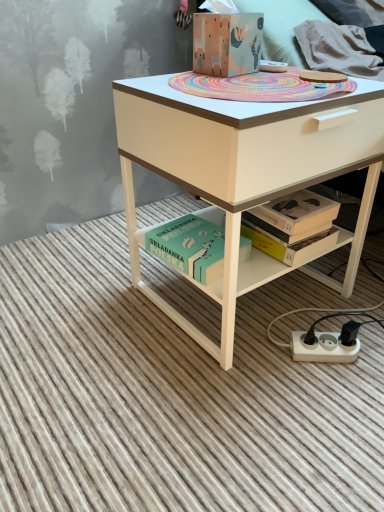
Question: From a real-world perspective, is white plastic power plugs and sockets at lower right on top of matte white desk at center?

Choices:
 (A) no
 (B) yes

Answer: (A)

Question: From the image's perspective, is white plastic power plugs and sockets at lower right under matte white desk at center?

Choices:
 (A) no
 (B) yes

Answer: (B)

Question: Considering the relative positions of white plastic power plugs and sockets at lower right and matte white desk at center in the image provided, is white plastic power plugs and sockets at lower right to the right of matte white desk at center from the viewer's perspective?

Choices:
 (A) yes
 (B) no

Answer: (A)

Question: Is white plastic power plugs and sockets at lower right wider than matte white desk at center?

Choices:
 (A) yes
 (B) no

Answer: (B)

Question: Does white plastic power plugs and sockets at lower right have a lesser width compared to matte white desk at center?

Choices:
 (A) no
 (B) yes

Answer: (B)

Question: Is white plastic power plugs and sockets at lower right positioned with its back to matte white desk at center?

Choices:
 (A) no
 (B) yes

Answer: (B)

Question: Considering the relative sizes of matte white desk at center and green matte book at lower center in the image provided, is matte white desk at center taller than green matte book at lower center?

Choices:
 (A) no
 (B) yes

Answer: (B)

Question: Can you confirm if matte white desk at center is positioned to the right of green matte book at lower center?

Choices:
 (A) no
 (B) yes

Answer: (B)

Question: From the image's perspective, is matte white desk at center beneath green matte book at lower center?

Choices:
 (A) yes
 (B) no

Answer: (B)

Question: Does matte white desk at center touch green matte book at lower center?

Choices:
 (A) no
 (B) yes

Answer: (A)

Question: From a real-world perspective, is matte white desk at center positioned over green matte book at lower center based on gravity?

Choices:
 (A) no
 (B) yes

Answer: (B)

Question: Is matte white desk at center looking in the opposite direction of green matte book at lower center?

Choices:
 (A) yes
 (B) no

Answer: (B)

Question: Can you confirm if wooden painted box at center is shorter than white plastic power plugs and sockets at lower right?

Choices:
 (A) yes
 (B) no

Answer: (B)